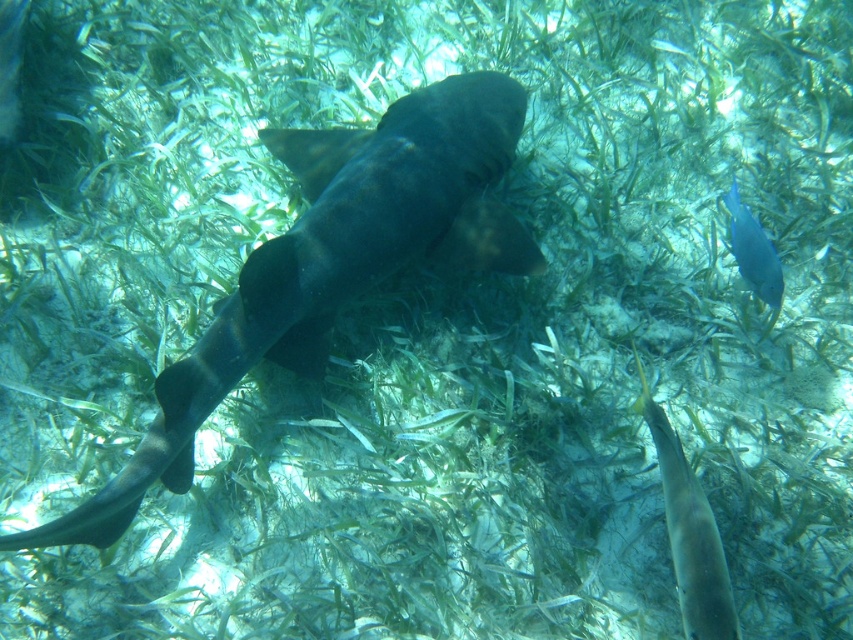
Which of these two, dark gray matte shark at center or blue glossy fish at upper right, stands taller?

With more height is dark gray matte shark at center.

Is dark gray matte shark at center taller than blue glossy fish at upper right?

Yes, dark gray matte shark at center is taller than blue glossy fish at upper right.

From the picture: Who is more forward, (x=454, y=161) or (x=746, y=205)?

Point (x=454, y=161) is more forward.

Image resolution: width=853 pixels, height=640 pixels. Find the location of `dark gray matte shark at center`. dark gray matte shark at center is located at coordinates (331, 264).

Is translucent yellowish fish at lower right positioned behind blue glossy fish at upper right?

No.

This screenshot has height=640, width=853. I want to click on translucent yellowish fish at lower right, so click(x=689, y=532).

Locate an element on the screen. translucent yellowish fish at lower right is located at coordinates (689, 532).

Measure the distance between dark gray matte shark at center and camera.

dark gray matte shark at center is 1.71 meters away from camera.

Between dark gray matte shark at center and translucent yellowish fish at lower right, which one has more height?

dark gray matte shark at center

Who is more distant from viewer, (506, 257) or (720, 616)?

Point (506, 257)

Image resolution: width=853 pixels, height=640 pixels. Find the location of `dark gray matte shark at center`. dark gray matte shark at center is located at coordinates (331, 264).